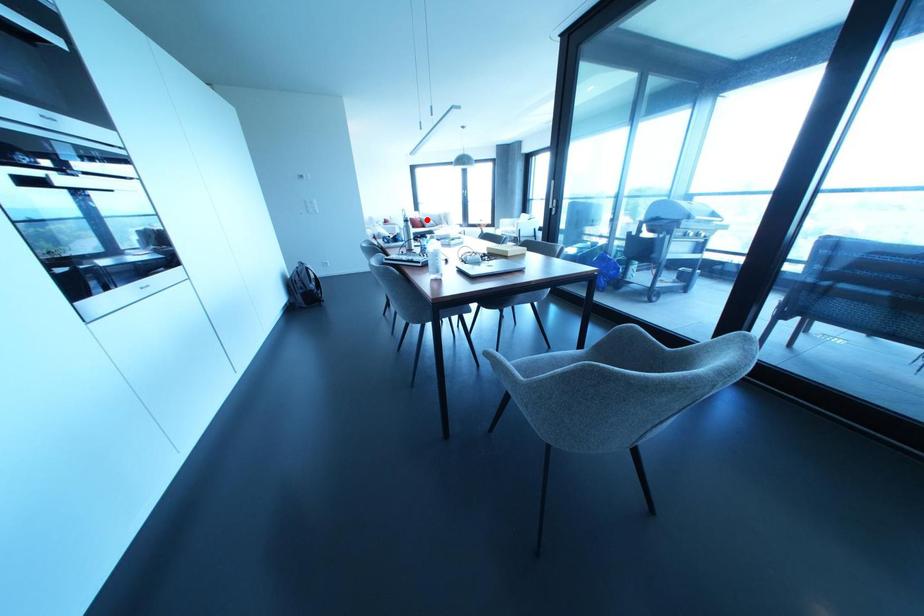
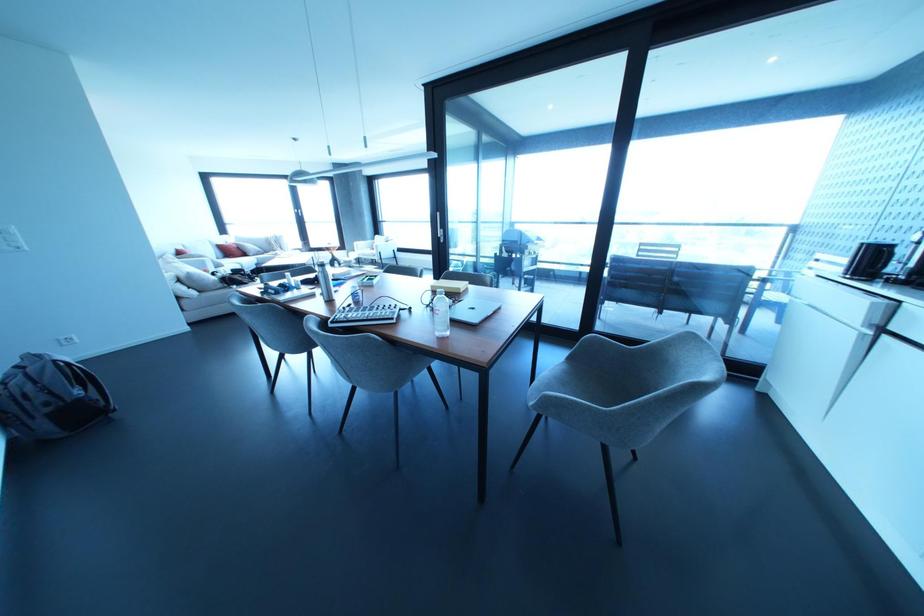
Question: I am providing you with two images of the same scene from different viewpoints. In image1, a red point is highlighted. Considering the same 3D point in image2, which of the following is correct?

Choices:
 (A) It is closer
 (B) It is farther

Answer: (A)